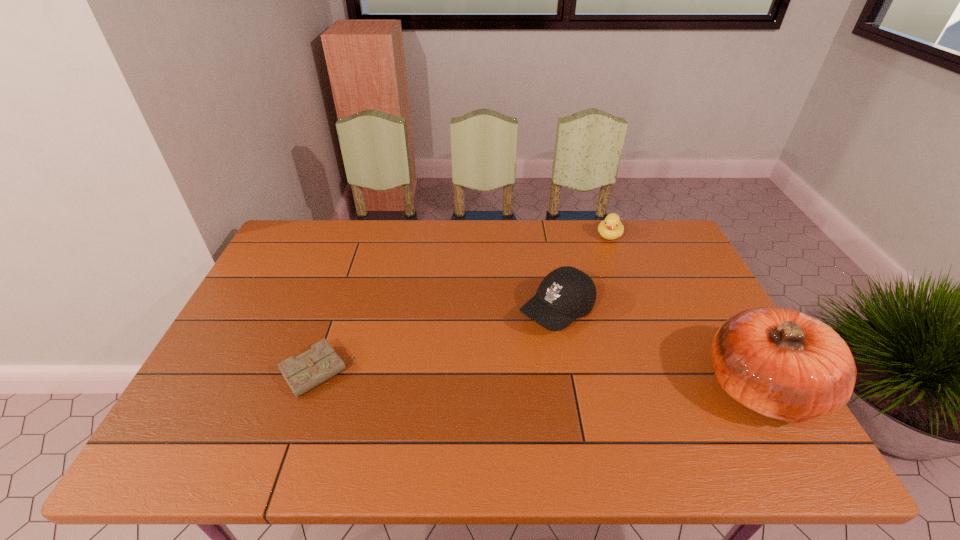
At what (x,y) coordinates should I click in order to perform the action: click on vacant space located on the front-facing side of the second tallest object. Please return your answer as a coordinate pair (x, y). This screenshot has width=960, height=540. Looking at the image, I should click on (507, 352).

The height and width of the screenshot is (540, 960). What are the coordinates of `vacant space located on the front-facing side of the second tallest object` in the screenshot? It's located at (509, 350).

Locate an element on the screen. The height and width of the screenshot is (540, 960). vacant area situated 0.370m on the front-facing side of the second tallest object is located at coordinates [425, 417].

The image size is (960, 540). In order to click on vacant space located on the beak of the third tallest object in this screenshot , I will do `click(603, 254)`.

Identify the location of vacant space situated 0.200m on the beak of the third tallest object. (593, 279).

At what (x,y) coordinates should I click in order to perform the action: click on blank area located 0.280m on the beak of the third tallest object. Please return your answer as a coordinate pair (x, y). Image resolution: width=960 pixels, height=540 pixels. Looking at the image, I should click on (588, 295).

Identify the location of object that is at the far edge. This screenshot has width=960, height=540. pyautogui.click(x=611, y=228).

What are the coordinates of `diary present at the near edge` in the screenshot? It's located at (311, 368).

I want to click on pumpkin that is at the near edge, so click(x=780, y=363).

Locate an element on the screen. object that is at the right edge is located at coordinates (780, 363).